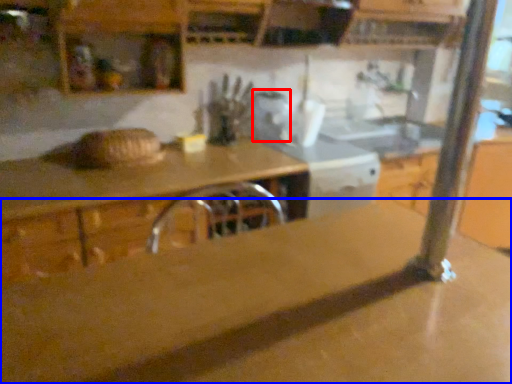
Question: Which object appears closest to the camera in this image, appliance (highlighted by a red box) or countertop (highlighted by a blue box)?

Choices:
 (A) appliance
 (B) countertop

Answer: (B)